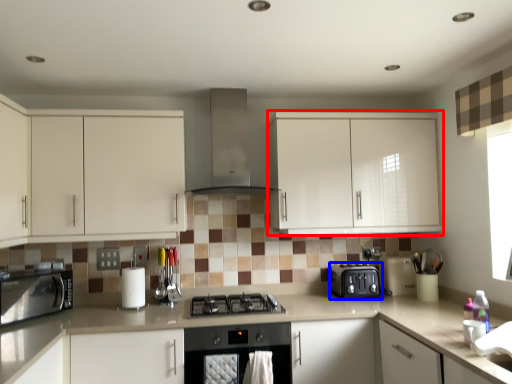
Question: Which of the following is the farthest to the observer, cabinetry (highlighted by a red box) or kitchen appliance (highlighted by a blue box)?

Choices:
 (A) cabinetry
 (B) kitchen appliance

Answer: (B)